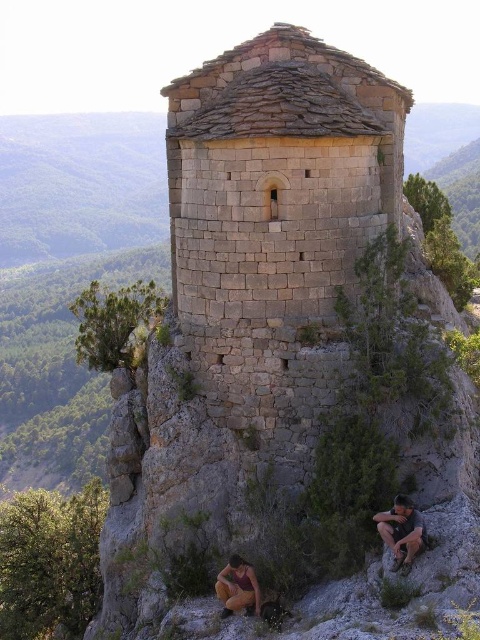
Question: Is matte gray rock at lower right further to the viewer compared to orange fabric pants at lower center?

Choices:
 (A) no
 (B) yes

Answer: (A)

Question: Is the position of matte gray rock at lower right less distant than that of orange fabric pants at lower center?

Choices:
 (A) yes
 (B) no

Answer: (A)

Question: Is the position of matte gray rock at lower right less distant than that of orange fabric pants at lower center?

Choices:
 (A) no
 (B) yes

Answer: (B)

Question: Which point is farther from the camera taking this photo?

Choices:
 (A) (228, 596)
 (B) (407, 554)

Answer: (A)

Question: Which point is farther to the camera?

Choices:
 (A) (227, 586)
 (B) (404, 513)

Answer: (A)

Question: Which object appears closest to the camera in this image?

Choices:
 (A) matte gray rock at lower right
 (B) orange fabric pants at lower center

Answer: (A)